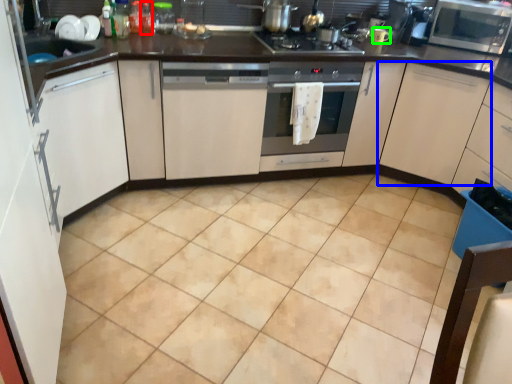
Question: Estimate the real-world distances between objects in this image. Which object is closer to bottle (highlighted by a red box), cabinetry (highlighted by a blue box) or appliance (highlighted by a green box)?

Choices:
 (A) cabinetry
 (B) appliance

Answer: (B)